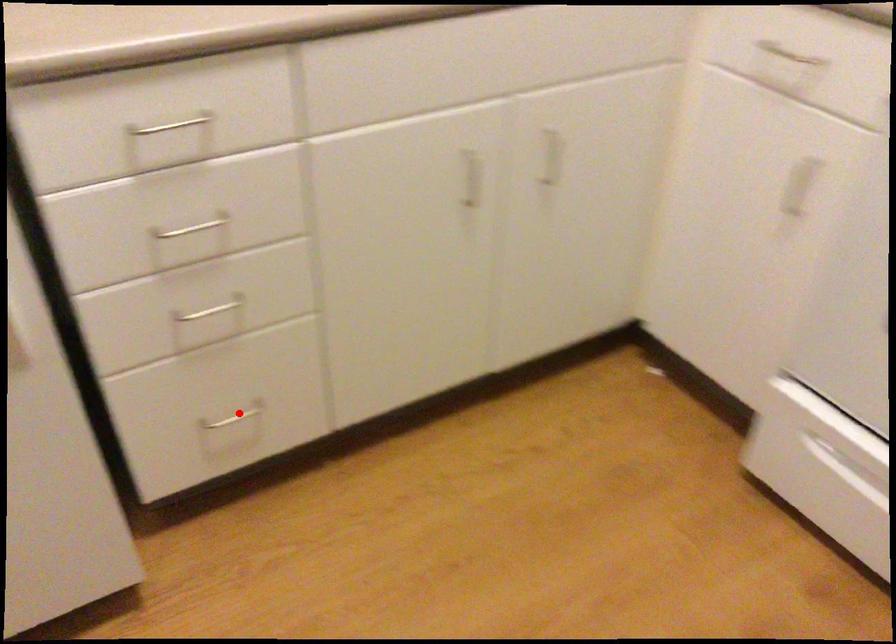
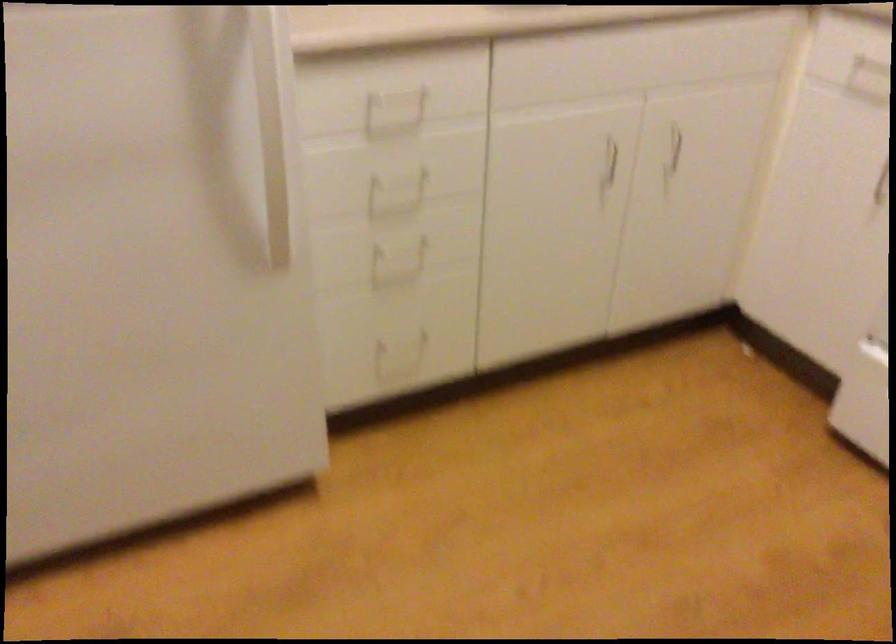
Question: I am providing you with two images of the same scene from different viewpoints. A red point is shown in image1. For the corresponding object point in image2, is it positioned nearer or farther from the camera?

Choices:
 (A) Nearer
 (B) Farther

Answer: (B)